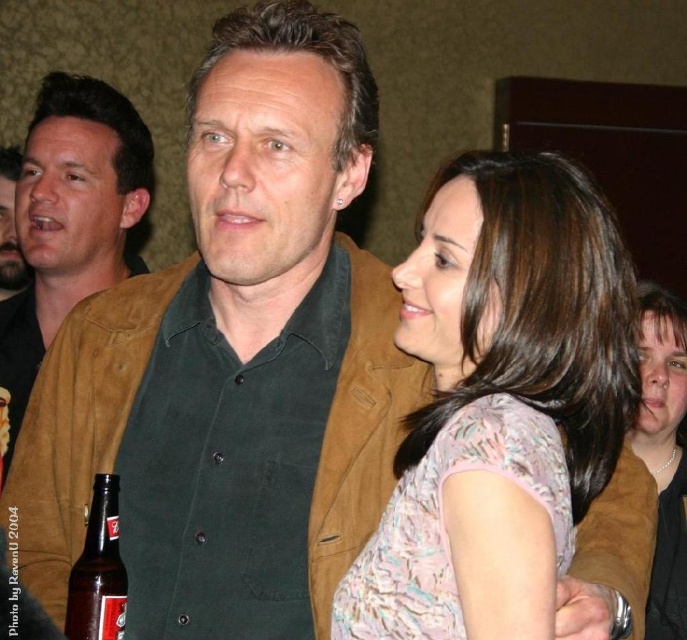
Question: Is brown suede jacket at center positioned before brown leather jacket at center?

Choices:
 (A) no
 (B) yes

Answer: (B)

Question: Which point appears closest to the camera in this image?

Choices:
 (A) (664, 545)
 (B) (115, 566)
 (C) (370, 541)

Answer: (C)

Question: Does brown leather jacket at center have a larger size compared to brown glass bottle at lower left?

Choices:
 (A) no
 (B) yes

Answer: (B)

Question: Does brown leather jacket at center come behind matte pink blouse at center?

Choices:
 (A) yes
 (B) no

Answer: (B)

Question: Among these objects, which one is farthest from the camera?

Choices:
 (A) matte pink floral blouse at center
 (B) matte pink blouse at center

Answer: (B)

Question: Which is farther from the matte pink floral blouse at center?

Choices:
 (A) brown glass bottle at lower left
 (B) brown suede jacket at center

Answer: (A)